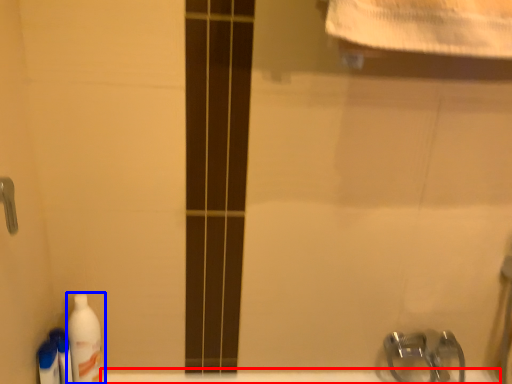
Question: Among these objects, which one is nearest to the camera, bath (highlighted by a red box) or cleaning product (highlighted by a blue box)?

Choices:
 (A) bath
 (B) cleaning product

Answer: (B)